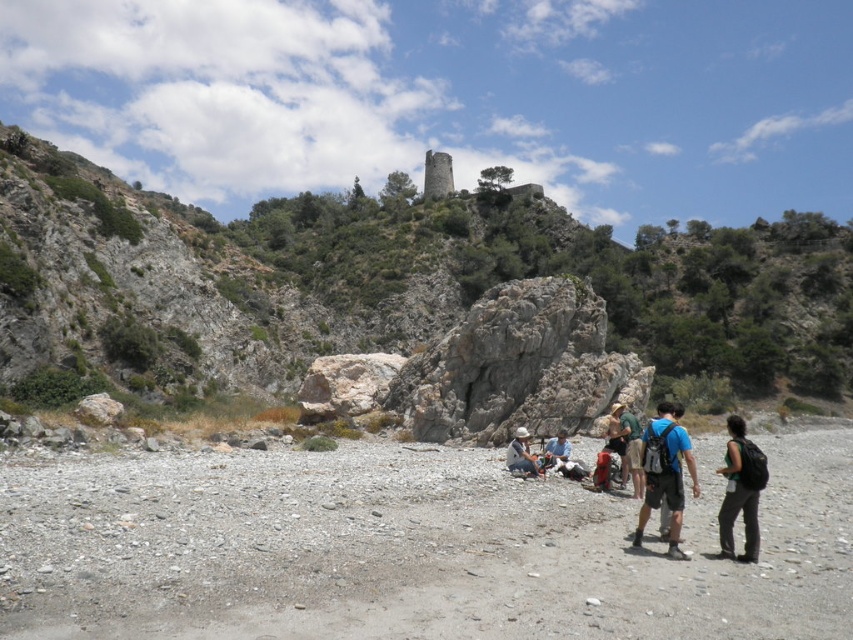
You are a hiker planning to move from the matte white helmet at center to the rocky terrain at upper center. Based on the scene description, what is the approximate distance you need to cover?

The distance between the matte white helmet at center and the rocky terrain at upper center is 77.96 meters, so you need to cover approximately 78 meters.

You are a hiker who has just arrived at the rocky landscape shown in the image. You need to retrieve your blue fabric backpack at lower right. Based on the coordinates provided, can you determine if the backpack is positioned closer to the center or the edge of the image?

The blue fabric backpack at lower right is located at point (x=666, y=474). Since both coordinates are greater than 0.5, it is positioned closer to the edge of the image rather than the center.

You are a hiker who wants to place both the blue fabric backpack at lower right and the green fabric backpack at center on a flat rock surface. The rock surface is 20 feet long. Can both backpacks fit on the rock surface without overlapping?

The blue fabric backpack at lower right is 22.06 feet from the green fabric backpack at center. Since the distance between them is greater than the rock surface length of 20 feet, the backpacks cannot be placed on the rock surface without overlapping.